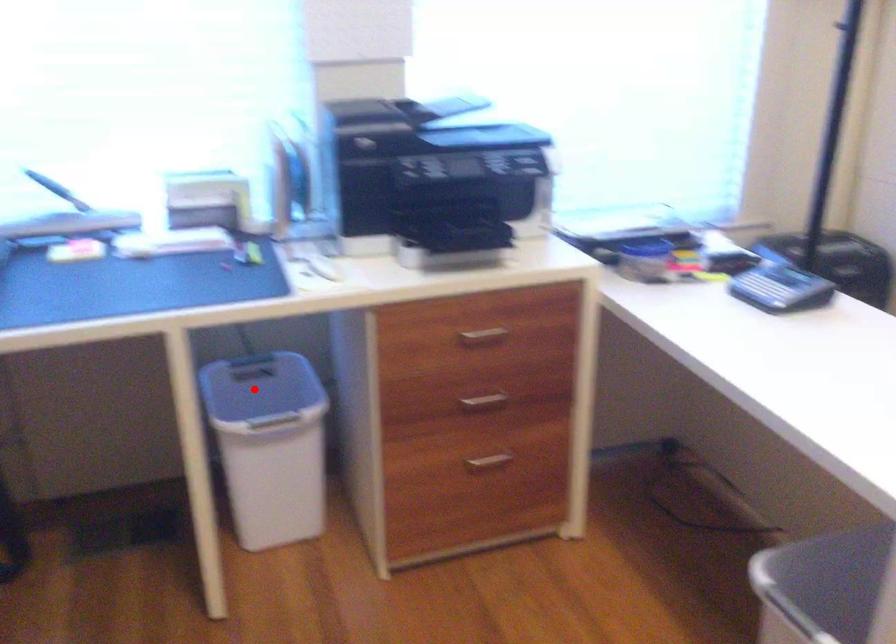
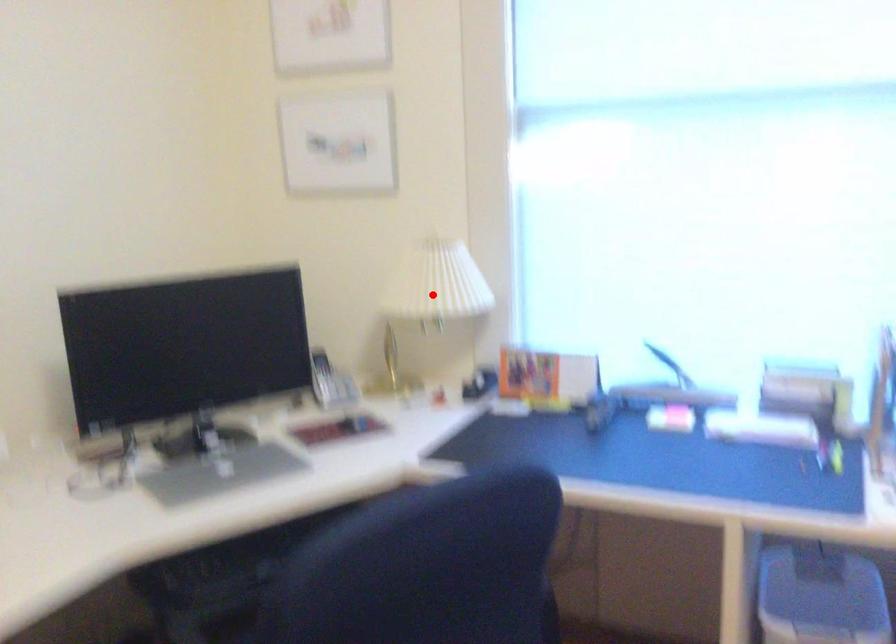
I am providing you with two images of the same scene from different viewpoints. A red point is marked on the first image and another point is marked on the second image. Is the red point in image1 aligned with the point shown in image2?

No